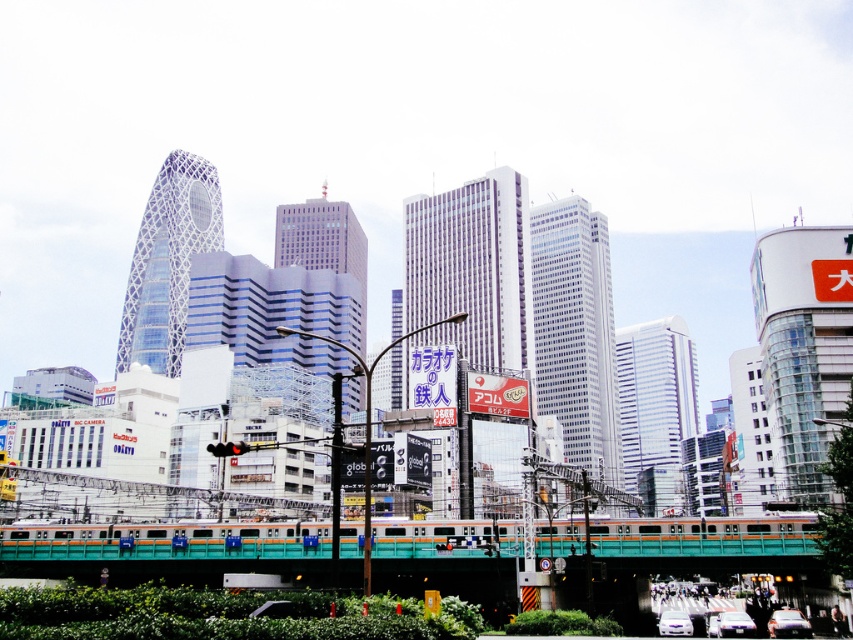
Question: Is the position of teal glossy train at center more distant than that of shiny silver sedan at center?

Choices:
 (A) yes
 (B) no

Answer: (A)

Question: Which object is closer to the camera taking this photo?

Choices:
 (A) teal glossy train at center
 (B) white glossy car at lower right

Answer: (B)

Question: Can you confirm if teal glossy train at center is positioned below white glossy car at lower right?

Choices:
 (A) yes
 (B) no

Answer: (B)

Question: Estimate the real-world distances between objects in this image. Which object is farther from the shiny silver sedan at center?

Choices:
 (A) teal glossy train at center
 (B) white glossy car at lower right

Answer: (A)

Question: Which point is closer to the camera?

Choices:
 (A) shiny silver sedan at center
 (B) teal glossy train at center
 (C) white glossy car at lower right

Answer: (C)

Question: Does teal glossy train at center appear on the left side of shiny silver sedan at center?

Choices:
 (A) yes
 (B) no

Answer: (A)